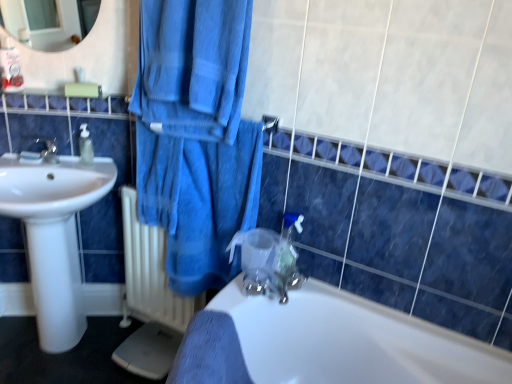
Question: Considering the relative sizes of transparent plastic faucet at center and white glossy sink at left in the image provided, is transparent plastic faucet at center bigger than white glossy sink at left?

Choices:
 (A) yes
 (B) no

Answer: (B)

Question: Considering the relative sizes of transparent plastic faucet at center and white glossy sink at left in the image provided, is transparent plastic faucet at center smaller than white glossy sink at left?

Choices:
 (A) no
 (B) yes

Answer: (B)

Question: Is transparent plastic faucet at center not near white glossy sink at left?

Choices:
 (A) no
 (B) yes

Answer: (A)

Question: Is transparent plastic faucet at center to the right of white glossy sink at left from the viewer's perspective?

Choices:
 (A) yes
 (B) no

Answer: (A)

Question: Is transparent plastic faucet at center beside white glossy sink at left?

Choices:
 (A) yes
 (B) no

Answer: (B)

Question: Considering the positions of white plastic balustrade at upper center and white glossy sink at left in the image, is white plastic balustrade at upper center taller or shorter than white glossy sink at left?

Choices:
 (A) tall
 (B) short

Answer: (B)

Question: In the image, is white plastic balustrade at upper center on the left side or the right side of white glossy sink at left?

Choices:
 (A) left
 (B) right

Answer: (B)

Question: From the image's perspective, relative to white glossy sink at left, is white plastic balustrade at upper center above or below?

Choices:
 (A) below
 (B) above

Answer: (B)

Question: Is white plastic balustrade at upper center wider or thinner than white glossy sink at left?

Choices:
 (A) wide
 (B) thin

Answer: (B)

Question: In terms of width, does transparent plastic faucet at center look wider or thinner when compared to white glossy sink at left?

Choices:
 (A) thin
 (B) wide

Answer: (A)

Question: In terms of height, does transparent plastic faucet at center look taller or shorter compared to white glossy sink at left?

Choices:
 (A) tall
 (B) short

Answer: (B)

Question: Visually, is transparent plastic faucet at center positioned to the left or to the right of white glossy sink at left?

Choices:
 (A) left
 (B) right

Answer: (B)

Question: From a real-world perspective, is transparent plastic faucet at center physically located above or below white glossy sink at left?

Choices:
 (A) above
 (B) below

Answer: (A)

Question: In terms of width, does white plastic balustrade at upper center look wider or thinner when compared to transparent plastic faucet at center?

Choices:
 (A) wide
 (B) thin

Answer: (A)

Question: Does point (104, 99) appear closer or farther from the camera than point (287, 235)?

Choices:
 (A) closer
 (B) farther

Answer: (B)